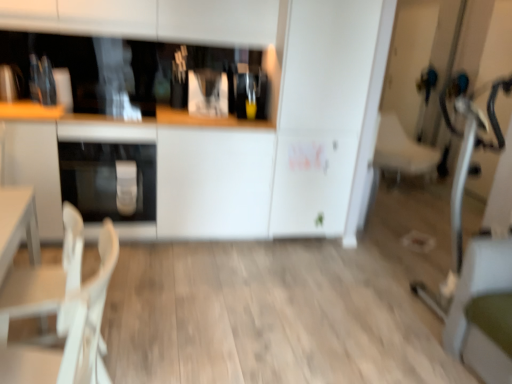
Question: Is white plastic chair at lower left, placed as the second armchair when sorted from back to front, in front of or behind wooden counter top at center in the image?

Choices:
 (A) front
 (B) behind

Answer: (A)

Question: Is white plastic chair at lower left, placed as the second armchair when sorted from back to front, situated inside wooden counter top at center or outside?

Choices:
 (A) inside
 (B) outside

Answer: (B)

Question: Considering the real-world distances, which object is farthest from the wooden counter top at center?

Choices:
 (A) satin silver oven at lower left
 (B) white fabric armchair at right, the 1th armchair positioned from the right
 (C) white plastic chair at lower left, marked as the first armchair in a bottom-to-top arrangement

Answer: (B)

Question: Estimate the real-world distances between objects in this image. Which object is closer to the white plastic chair at lower left, placed as the second armchair when sorted from back to front?

Choices:
 (A) satin silver oven at lower left
 (B) white fabric armchair at right, the 1th armchair viewed from the back
 (C) wooden counter top at center

Answer: (A)